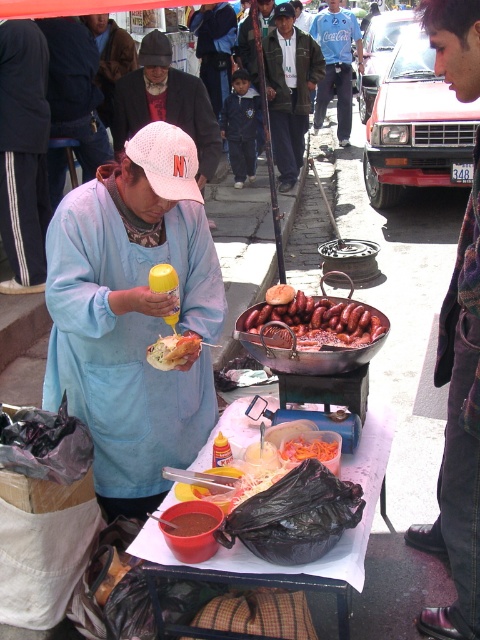
Can you confirm if dark green jacket at center is thinner than sausageglazedatcenter?

In fact, dark green jacket at center might be wider than sausageglazedatcenter.

Is the position of dark green jacket at center less distant than that of sausageglazedatcenter?

No, dark green jacket at center is behind sausageglazedatcenter.

Does point (271, 106) lie in front of point (343, 348)?

No.

Find the location of a particular element. The width and height of the screenshot is (480, 640). dark green jacket at center is located at coordinates (289, 90).

Does dark green jacket at center have a lesser height compared to carrot shredded at center?

Incorrect, dark green jacket at center's height does not fall short of carrot shredded at center's.

The image size is (480, 640). I want to click on dark green jacket at center, so click(289, 90).

In the scene shown: Measure the distance between dark green jacket at center and camera.

25.45 feet

Locate an element on the screen. dark green jacket at center is located at coordinates (289, 90).

Who is higher up, sausageglazedatcenter or golden crispy bread at center?

Positioned higher is sausageglazedatcenter.

You are a GUI agent. You are given a task and a screenshot of the screen. Output one action in this format:
    pyautogui.click(x=<x>, y=<y>)
    Task: Click on the sausageglazedatcenter
    Image resolution: width=480 pixels, height=640 pixels.
    Given the screenshot: What is the action you would take?
    pyautogui.click(x=314, y=323)

Locate an element on the screen. This screenshot has width=480, height=640. sausageglazedatcenter is located at coordinates (314, 323).